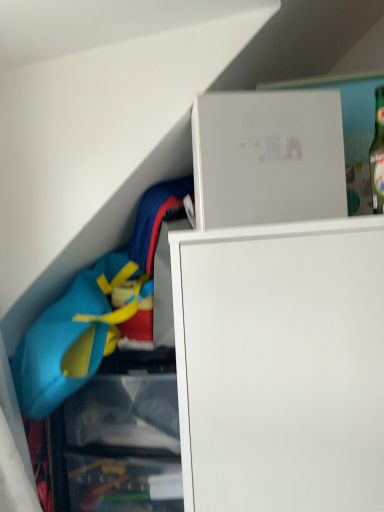
Locate an element on the screen. The height and width of the screenshot is (512, 384). empty space that is ontop of matte blue life vest at left (from a real-world perspective) is located at coordinates (59, 245).